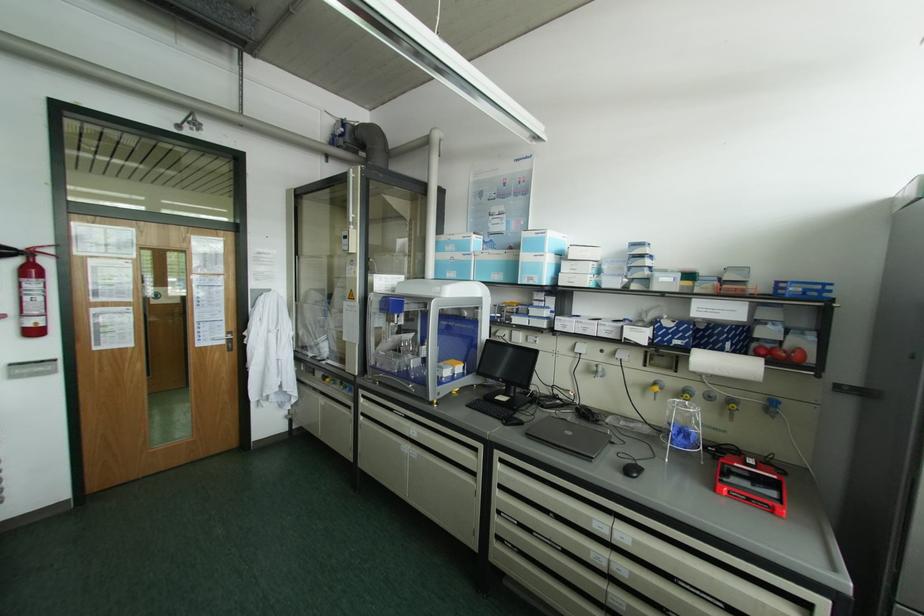
What are the coordinates of `silver door handle` in the screenshot? It's located at (219, 336).